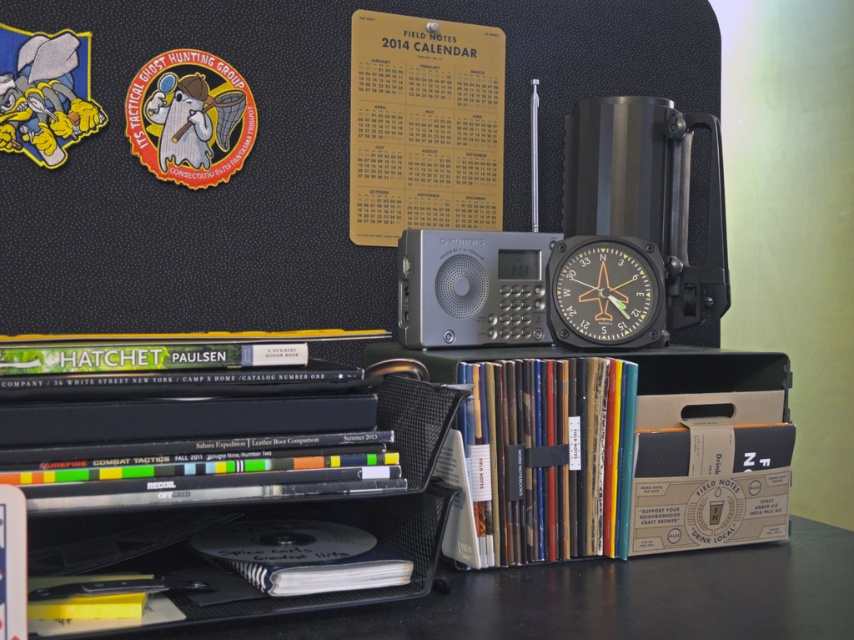
Question: Can you confirm if cardboard box at center is smaller than matte black compass at center?

Choices:
 (A) yes
 (B) no

Answer: (B)

Question: Can you confirm if black mesh organizer at lower left is positioned above matte black compass at center?

Choices:
 (A) no
 (B) yes

Answer: (A)

Question: Can you confirm if black mesh organizer at lower left is positioned to the right of matte black compass at center?

Choices:
 (A) no
 (B) yes

Answer: (A)

Question: Which point appears farthest from the camera in this image?

Choices:
 (A) pos(335,609)
 (B) pos(566,340)
 (C) pos(604,456)

Answer: (B)

Question: Estimate the real-world distances between objects in this image. Which object is farther from the cardboard box at center?

Choices:
 (A) matte black compass at center
 (B) black mesh organizer at lower left

Answer: (A)

Question: Which point appears farthest from the camera in this image?

Choices:
 (A) (592, 346)
 (B) (633, 531)
 (C) (665, 563)

Answer: (A)